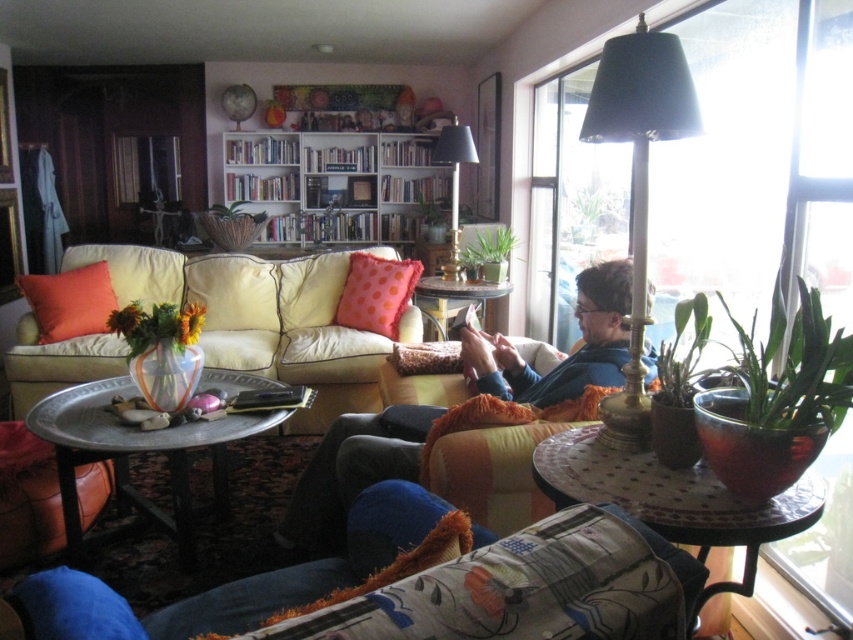
Who is lower down, fluffy blue cushion at lower left or orange fabric pillow at left?

fluffy blue cushion at lower left is below.

Can you confirm if fluffy blue cushion at lower left is wider than orange fabric pillow at left?

In fact, fluffy blue cushion at lower left might be narrower than orange fabric pillow at left.

Describe the element at coordinates (413, 595) in the screenshot. I see `fluffy blue cushion at lower left` at that location.

Locate an element on the screen. The image size is (853, 640). fluffy blue cushion at lower left is located at coordinates (413, 595).

Is transparent glass window at upper right taller than blue fleece sweater at center?

Indeed, transparent glass window at upper right has a greater height compared to blue fleece sweater at center.

The height and width of the screenshot is (640, 853). Describe the element at coordinates (729, 161) in the screenshot. I see `transparent glass window at upper right` at that location.

Between point (708, 230) and point (335, 435), which one is positioned in front?

Positioned in front is point (335, 435).

The width and height of the screenshot is (853, 640). Identify the location of transparent glass window at upper right. (729, 161).

Is wooden bookshelf at upper center positioned behind orange fabric pillow at left?

Yes, it is.

Can you confirm if wooden bookshelf at upper center is positioned above orange fabric pillow at left?

Correct, wooden bookshelf at upper center is located above orange fabric pillow at left.

Between point (413, 214) and point (97, 262), which one is positioned in front?

Point (97, 262) is in front.

Locate an element on the screen. wooden bookshelf at upper center is located at coordinates (341, 186).